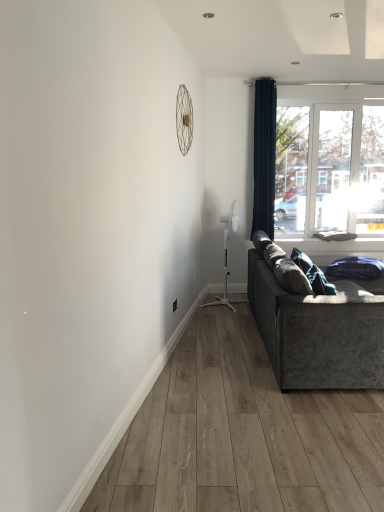
Question: Considering the positions of point (223, 301) and point (316, 289), is point (223, 301) closer or farther from the camera than point (316, 289)?

Choices:
 (A) closer
 (B) farther

Answer: (B)

Question: From a real-world perspective, is white plastic mechanical fan at center-right, which is counted as the 2th mechanical fan, starting from the top, physically located above or below velvet blue pillow at lower right?

Choices:
 (A) below
 (B) above

Answer: (A)

Question: Considering the real-world distances, which object is closest to the metallic wire at upper center, which ranks as the 2th mechanical fan in bottom-to-top order?

Choices:
 (A) velvet grey couch at right
 (B) navy velvet curtain at upper right
 (C) transparent glass window at upper right
 (D) white plastic mechanical fan at center-right, arranged as the 2th mechanical fan when viewed from the front
 (E) velvet blue pillow at lower right

Answer: (B)

Question: Which object is positioned farthest from the velvet blue pillow at lower right?

Choices:
 (A) metallic wire at upper center, which appears as the 1th mechanical fan when viewed from the left
 (B) velvet grey couch at right
 (C) white plastic mechanical fan at center-right, the 1th mechanical fan viewed from the back
 (D) transparent glass window at upper right
 (E) navy velvet curtain at upper right

Answer: (D)